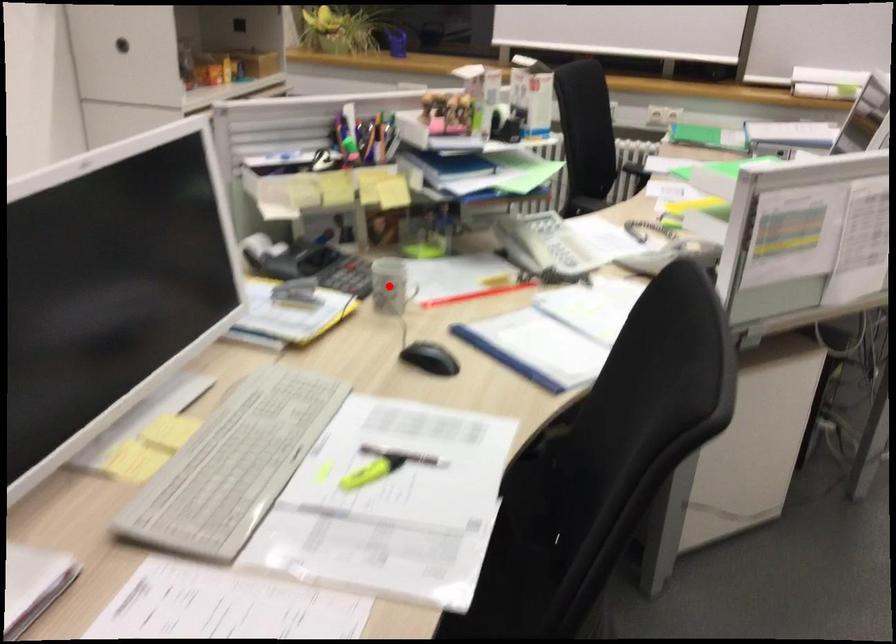
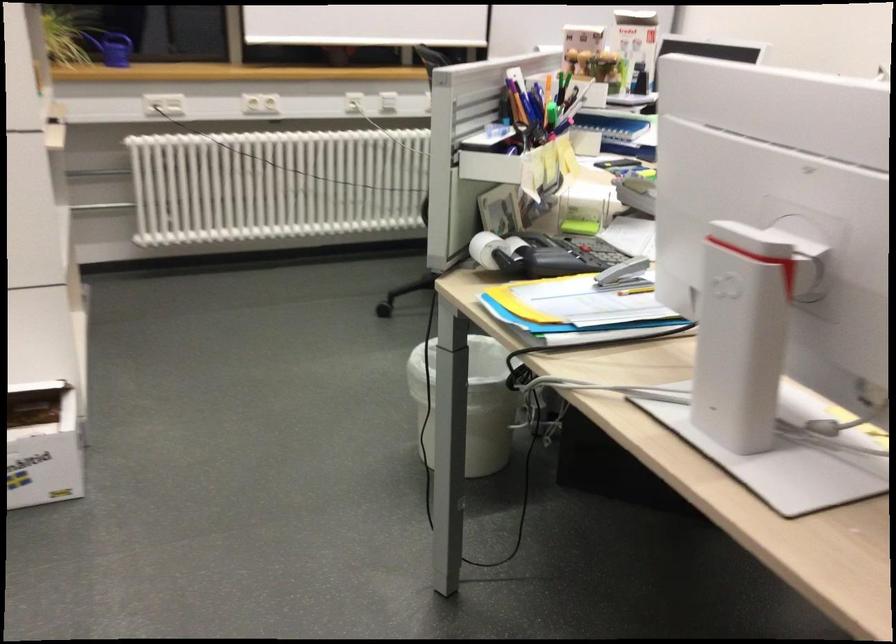
Question: I am providing you with two images of the same scene from different viewpoints. A red point is marked on the first image. Can you still see the location of the red point in image 2?

Choices:
 (A) Yes
 (B) No

Answer: (B)